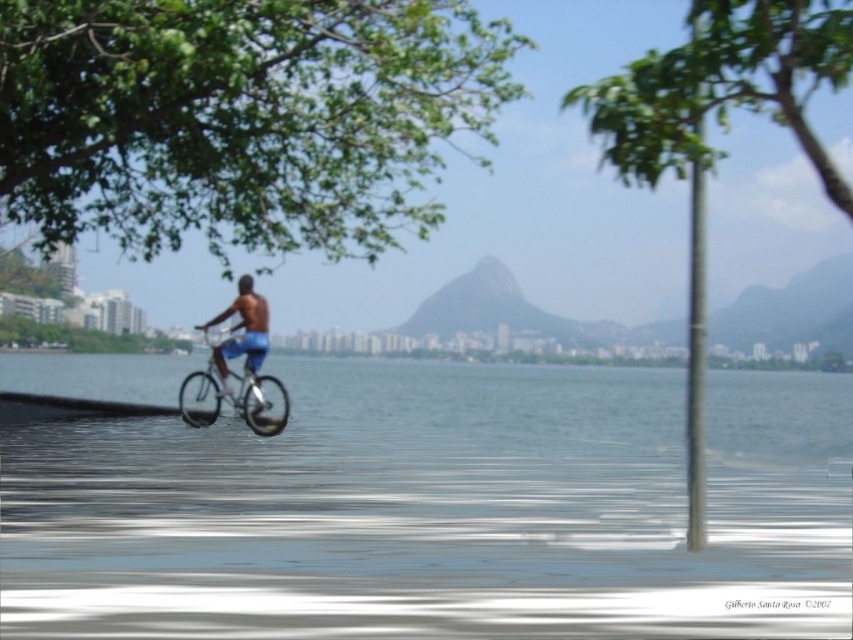
Is green leafy tree at upper right taller than green leafy tree at upper center?

Yes.

Which is more to the left, green leafy tree at upper right or green leafy tree at upper center?

Positioned to the left is green leafy tree at upper center.

Between point (688, 445) and point (660, 90), which one is positioned in front?

Point (660, 90) is more forward.

Find the location of a particular element. The image size is (853, 640). green leafy tree at upper right is located at coordinates (722, 125).

What do you see at coordinates (722, 125) in the screenshot? The width and height of the screenshot is (853, 640). I see `green leafy tree at upper right` at bounding box center [722, 125].

Measure the distance between green leafy tree at upper right and camera.

green leafy tree at upper right is 6.25 meters away from camera.

The height and width of the screenshot is (640, 853). I want to click on green leafy tree at upper right, so click(722, 125).

Describe the element at coordinates (439, 509) in the screenshot. This screenshot has width=853, height=640. I see `clear water at center` at that location.

Who is positioned more to the left, clear water at center or green leafy tree at upper right?

clear water at center is more to the left.

Does point (138, 522) come behind point (682, 118)?

Yes.

This screenshot has height=640, width=853. Identify the location of clear water at center. (439, 509).